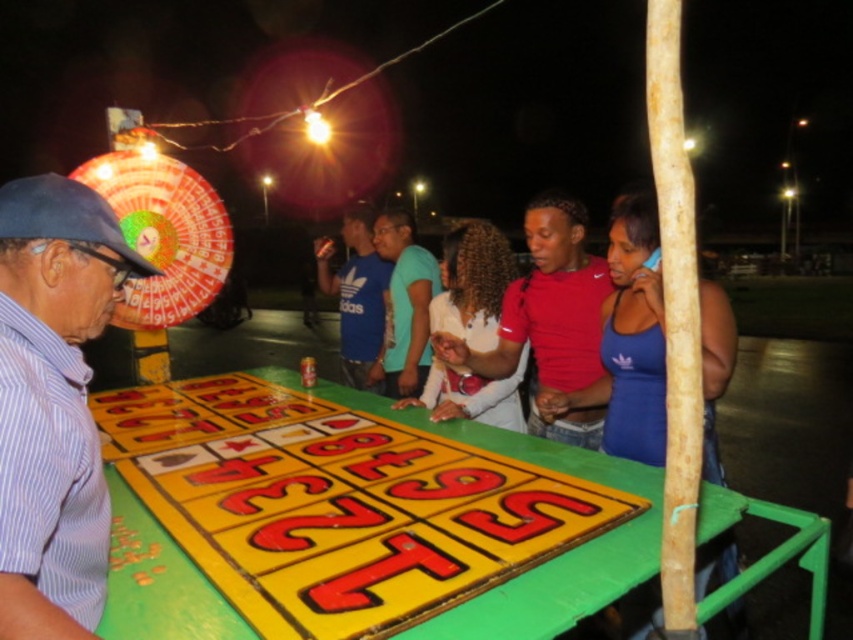
Question: Is matte pink shirt at center thinner than teal matte shirt at center?

Choices:
 (A) no
 (B) yes

Answer: (A)

Question: Estimate the real-world distances between objects in this image. Which object is closer to the teal matte shirt at center?

Choices:
 (A) striped cotton shirt at left
 (B) blue cotton shirt at center
 (C) yellow painted wood table at center
 (D) matte pink shirt at center

Answer: (B)

Question: Can you confirm if yellow painted wood table at center is bigger than teal matte shirt at center?

Choices:
 (A) yes
 (B) no

Answer: (A)

Question: Based on their relative distances, which object is farther from the blue cotton shirt at center?

Choices:
 (A) teal matte shirt at center
 (B) matte pink shirt at center
 (C) striped cotton shirt at left
 (D) yellow painted wood table at center

Answer: (C)

Question: Is yellow painted wood table at center wider than teal matte shirt at center?

Choices:
 (A) no
 (B) yes

Answer: (B)

Question: Which point appears farthest from the camera in this image?

Choices:
 (A) (128, 529)
 (B) (82, 497)
 (C) (506, 369)

Answer: (C)